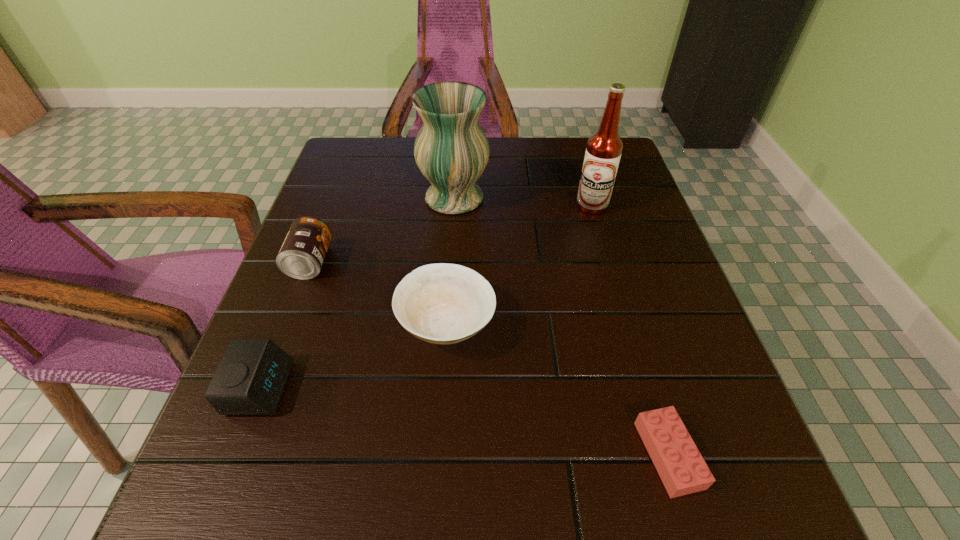
Where is `free space that satisfies the following two spatial constraints: 1. on the label side of the shortest object; 2. on the left side of the alcohol`? Image resolution: width=960 pixels, height=540 pixels. free space that satisfies the following two spatial constraints: 1. on the label side of the shortest object; 2. on the left side of the alcohol is located at coordinates (664, 455).

You are a GUI agent. You are given a task and a screenshot of the screen. Output one action in this format:
    pyautogui.click(x=<x>, y=<y>)
    Task: Click on the vacant area that satisfies the following two spatial constraints: 1. on the front-facing side of the alarm clock; 2. on the right side of the shortest object
    
    Given the screenshot: What is the action you would take?
    pyautogui.click(x=234, y=455)

Find the location of a particular element. The image size is (960, 540). vacant space that satisfies the following two spatial constraints: 1. on the front label of the fourth nearest object; 2. on the left side of the bowl is located at coordinates (287, 324).

Identify the location of free region that satisfies the following two spatial constraints: 1. on the label side of the alcohol; 2. on the front-facing side of the alarm clock. (645, 388).

Where is `vacant space that satisfies the following two spatial constraints: 1. on the label side of the shortest object; 2. on the right side of the alcohol`? vacant space that satisfies the following two spatial constraints: 1. on the label side of the shortest object; 2. on the right side of the alcohol is located at coordinates (664, 455).

This screenshot has height=540, width=960. Identify the location of free space that satisfies the following two spatial constraints: 1. on the front side of the Lego; 2. on the right side of the bowl. (438, 455).